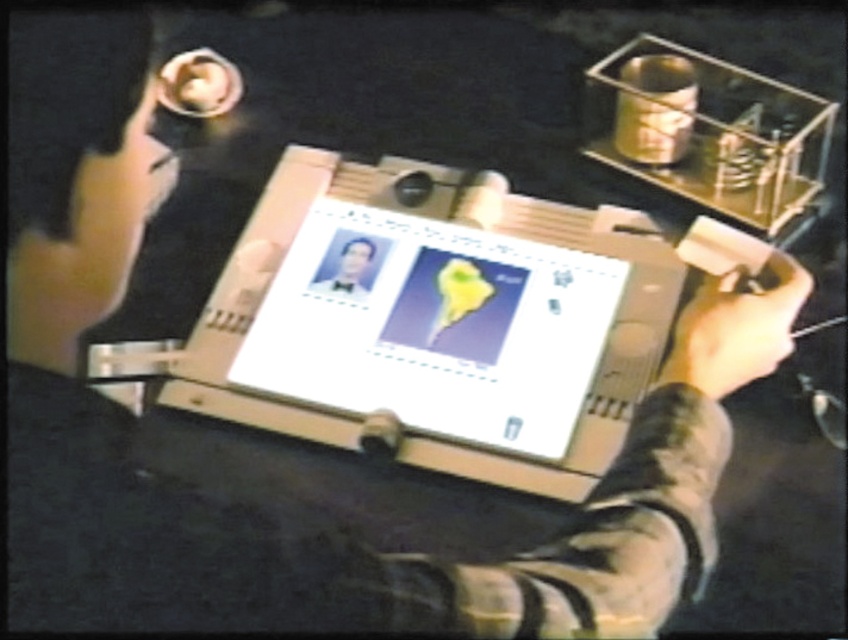
You are a photographer adjusting the lighting in a studio. You have a matte black hand at center and a smooth skin portrait at center in your frame. The distance between them is crucial for the shot. Can you fit both subjects within a 12 inch wide camera frame without moving them?

The matte black hand at center is 10.94 inches from the smooth skin portrait at center, so yes, both subjects can fit within a 12 inch wide camera frame since the distance between them is less than the frame width.

You are an archivist working with a lightbox to view old documents. You need to place a new transparency slide of a historical map onto the lightbox. The slide must be placed precisely at the center of the lightbox. Given that the lightbox has a coordinate system where the bottom left corner is the origin point, can you confirm if the point at coordinates (436,328) is the center of the lightbox?

The point at coordinates (436,328) indicates the matte plastic computer screen at center, so yes, placing the transparency slide at this point would position it precisely at the center of the lightbox.